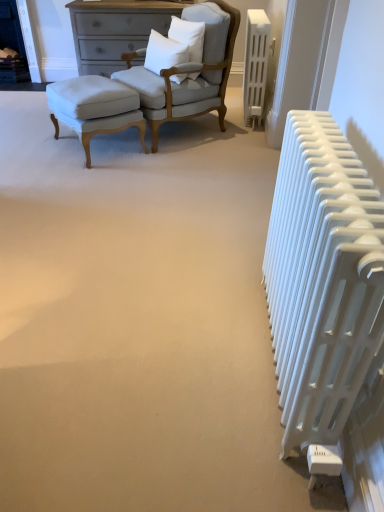
What is the approximate height of white soft pillow at upper center, which is the 1th pillow in right-to-left order?

white soft pillow at upper center, which is the 1th pillow in right-to-left order, is 17.37 inches in height.

At what (x,y) coordinates should I click in order to perform the action: click on white plastic radiator at upper right, which ranks as the 2th radiator in bottom-to-top order. Please return your answer as a coordinate pair (x, y). This screenshot has width=384, height=512. Looking at the image, I should click on (255, 65).

This screenshot has width=384, height=512. I want to click on white soft pillow at upper center, which is the 1th pillow in right-to-left order, so click(x=188, y=36).

The image size is (384, 512). Find the location of `the 2nd pillow behind the light beige fabric stool at center-left, starting your count from the anchor`. the 2nd pillow behind the light beige fabric stool at center-left, starting your count from the anchor is located at coordinates (188, 36).

Which is in front, point (178, 18) or point (105, 79)?

The point (105, 79) is closer to the camera.

From their relative heights in the image, would you say white soft pillow at upper center, which is the second pillow from left to right, is taller or shorter than light beige fabric stool at center-left?

In the image, white soft pillow at upper center, which is the second pillow from left to right, appears to be shorter than light beige fabric stool at center-left.

Consider the image. Is white soft pillow at upper center, which is the second pillow from left to right, not within light beige fabric stool at center-left?

Yes.

The height and width of the screenshot is (512, 384). Identify the location of chair below the white soft pillow at upper center, which is the second pillow from left to right (from the image's perspective). (196, 79).

Which is more to the left, matte white fabric chair at upper left or white soft pillow at upper center, which is the second pillow from left to right?

From the viewer's perspective, matte white fabric chair at upper left appears more on the left side.

Which is behind, point (222, 91) or point (192, 26)?

Point (222, 91)

Considering the sizes of objects matte white fabric chair at upper left and white soft pillow at upper center, which is the second pillow from left to right, in the image provided, who is wider, matte white fabric chair at upper left or white soft pillow at upper center, which is the second pillow from left to right,?

matte white fabric chair at upper left is wider.

In terms of height, does light beige fabric stool at center-left look taller or shorter compared to matte white fabric chair at upper left?

Clearly, light beige fabric stool at center-left is shorter compared to matte white fabric chair at upper left.

Can you confirm if light beige fabric stool at center-left is smaller than matte white fabric chair at upper left?

Yes, light beige fabric stool at center-left is smaller than matte white fabric chair at upper left.

Is the surface of light beige fabric stool at center-left in direct contact with matte white fabric chair at upper left?

No, light beige fabric stool at center-left is not beside matte white fabric chair at upper left.

Is light beige fabric stool at center-left looking in the opposite direction of matte white fabric chair at upper left?

No, light beige fabric stool at center-left is not facing away from matte white fabric chair at upper left.

Is matte white fabric chair at upper left wider than white plastic radiator at right, which is counted as the 1th radiator, starting from the front?

Correct, the width of matte white fabric chair at upper left exceeds that of white plastic radiator at right, which is counted as the 1th radiator, starting from the front.

Is white plastic radiator at right, which appears as the first radiator when ordered from the bottom, inside matte white fabric chair at upper left?

No, white plastic radiator at right, which appears as the first radiator when ordered from the bottom, is not inside matte white fabric chair at upper left.

In the scene shown: From their relative heights in the image, would you say white soft pillow at upper center, which is the second pillow from left to right, is taller or shorter than white plastic radiator at upper right, which ranks as the 2th radiator in bottom-to-top order?

white soft pillow at upper center, which is the second pillow from left to right, is shorter than white plastic radiator at upper right, which ranks as the 2th radiator in bottom-to-top order.

This screenshot has height=512, width=384. I want to click on radiator lying behind the white soft pillow at upper center, which is the 1th pillow in right-to-left order, so click(x=255, y=65).

Does white soft pillow at upper center, which is the second pillow from left to right, have a greater width compared to white plastic radiator at upper right, positioned as the first radiator in back-to-front order?

Correct, the width of white soft pillow at upper center, which is the second pillow from left to right, exceeds that of white plastic radiator at upper right, positioned as the first radiator in back-to-front order.

From a real-world perspective, is white soft pillow at upper center, which is the 1th pillow in right-to-left order, on top of white plastic radiator at upper right, which ranks as the 2th radiator in bottom-to-top order?

Yes, from a real-world perspective, white soft pillow at upper center, which is the 1th pillow in right-to-left order, is on top of white plastic radiator at upper right, which ranks as the 2th radiator in bottom-to-top order.

From the image's perspective, which one is positioned lower, white plastic radiator at upper right, positioned as the first radiator in back-to-front order, or light beige fabric stool at center-left?

From the image's view, light beige fabric stool at center-left is below.

Could you tell me if white plastic radiator at upper right, which ranks as the 2th radiator in bottom-to-top order, is turned towards light beige fabric stool at center-left?

Yes, white plastic radiator at upper right, which ranks as the 2th radiator in bottom-to-top order, is facing light beige fabric stool at center-left.

Between white plastic radiator at upper right, positioned as the first radiator in back-to-front order, and light beige fabric stool at center-left, which one has larger width?

Wider between the two is light beige fabric stool at center-left.

How much distance is there between white plastic radiator at upper right, positioned as the first radiator in back-to-front order, and light beige fabric stool at center-left?

A distance of 3.95 feet exists between white plastic radiator at upper right, positioned as the first radiator in back-to-front order, and light beige fabric stool at center-left.

In order to click on radiator that appears above the light beige fabric stool at center-left (from the image's perspective) in this screenshot , I will do click(255, 65).

Does point (86, 80) lie behind point (247, 42)?

No, it is not.

Is light beige fabric stool at center-left taller or shorter than white plastic radiator at upper right, which ranks as the 2th radiator in bottom-to-top order?

Considering their sizes, light beige fabric stool at center-left has less height than white plastic radiator at upper right, which ranks as the 2th radiator in bottom-to-top order.

From the image's perspective, starting from the light beige fabric stool at center-left, which pillow is the 2nd one above? Please provide its 2D coordinates.

[(188, 36)]

I want to click on chair lying below the white soft pillow at upper center, which is the 1th pillow in right-to-left order (from the image's perspective), so click(x=196, y=79).

Based on the photo, based on their spatial positions, is white plastic radiator at right, which appears as the first radiator when ordered from the bottom, or white plastic radiator at upper right, which appears as the first radiator when viewed from the top, further from light beige fabric stool at center-left?

white plastic radiator at right, which appears as the first radiator when ordered from the bottom, lies further to light beige fabric stool at center-left than the other object.

Based on their spatial positions, is white soft pillow at center, which is the second pillow from right to left, or light beige fabric stool at center-left closer to matte white fabric chair at upper left?

white soft pillow at center, which is the second pillow from right to left, lies closer to matte white fabric chair at upper left than the other object.

Which object lies nearer to the anchor point matte white fabric chair at upper left, white plastic radiator at right, which ranks as the second radiator in back-to-front order, or white soft pillow at upper center, which is the second pillow from left to right?

Based on the image, white soft pillow at upper center, which is the second pillow from left to right, appears to be nearer to matte white fabric chair at upper left.

Estimate the real-world distances between objects in this image. Which object is further from white soft pillow at upper center, which is the second pillow from left to right, white soft pillow at center, which is the second pillow from right to left, or matte white fabric chair at upper left?

Among the two, matte white fabric chair at upper left is located further to white soft pillow at upper center, which is the second pillow from left to right.

Based on their spatial positions, is matte white fabric chair at upper left or light beige fabric stool at center-left closer to white plastic radiator at upper right, the 2th radiator when ordered from front to back?

Based on the image, matte white fabric chair at upper left appears to be nearer to white plastic radiator at upper right, the 2th radiator when ordered from front to back.

From the picture: Based on their spatial positions, is matte white fabric chair at upper left or white soft pillow at center, which is the first pillow from left to right, closer to white plastic radiator at upper right, which ranks as the 2th radiator in bottom-to-top order?

matte white fabric chair at upper left lies closer to white plastic radiator at upper right, which ranks as the 2th radiator in bottom-to-top order, than the other object.

Which object lies further to the anchor point white plastic radiator at upper right, which appears as the first radiator when viewed from the top, white soft pillow at center, which is the first pillow from left to right, or light beige fabric stool at center-left?

light beige fabric stool at center-left is further to white plastic radiator at upper right, which appears as the first radiator when viewed from the top.

From the image, which object appears to be nearer to white plastic radiator at right, which is the second radiator from top to bottom, white soft pillow at upper center, which is the 1th pillow in right-to-left order, or white soft pillow at center, which is the second pillow from right to left?

white soft pillow at center, which is the second pillow from right to left, is closer to white plastic radiator at right, which is the second radiator from top to bottom.

Locate an element on the screen. This screenshot has width=384, height=512. chair located between white plastic radiator at right, which appears as the first radiator when ordered from the bottom, and white plastic radiator at upper right, which appears as the first radiator when viewed from the top, in the depth direction is located at coordinates point(196,79).

Locate an element on the screen. The height and width of the screenshot is (512, 384). chair between white plastic radiator at right, which appears as the first radiator when ordered from the bottom, and light beige fabric stool at center-left from front to back is located at coordinates (196, 79).

Where is `chair between white plastic radiator at right, which is counted as the 1th radiator, starting from the front, and white soft pillow at upper center, which is the 1th pillow in right-to-left order, along the z-axis`? Image resolution: width=384 pixels, height=512 pixels. chair between white plastic radiator at right, which is counted as the 1th radiator, starting from the front, and white soft pillow at upper center, which is the 1th pillow in right-to-left order, along the z-axis is located at coordinates (196, 79).

In order to click on pillow located between white soft pillow at center, which is the second pillow from right to left, and white plastic radiator at upper right, which ranks as the 2th radiator in bottom-to-top order, in the left-right direction in this screenshot , I will do `click(188, 36)`.